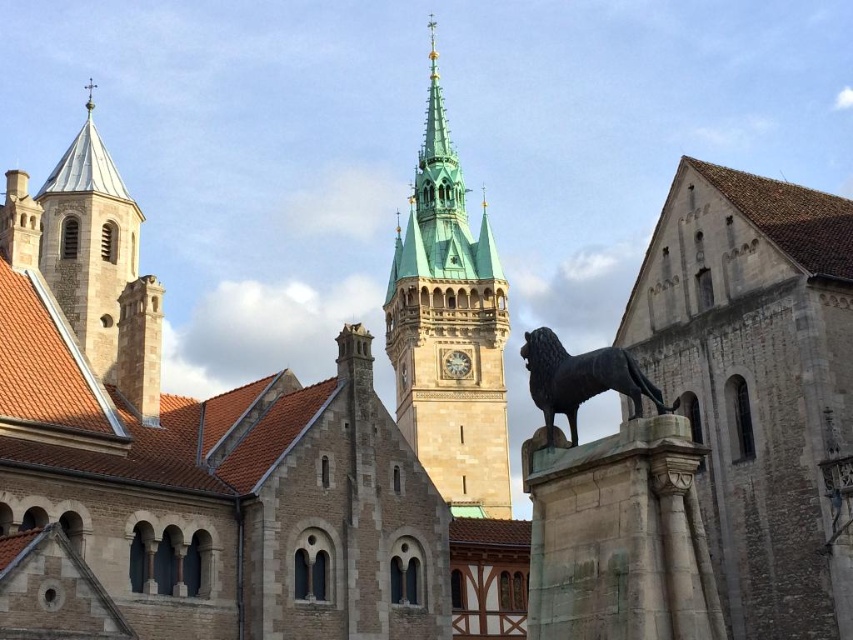
You are an architect designing a new pathway between the bronze statue at center and the metallic clock at center. To ensure accessibility, the path must be at least 1.2 meters wide. Based on the scene, can you confirm if there is enough space between them?

The bronze statue at center might be wider than metallic clock at center, so the space between them may not be sufficient for a 1.2 meter wide path. Further measurements would be needed to confirm.

You are a tourist standing in front of the historic architectural ensemble. You notice the smooth stone tower at upper left and the bronze statue at center. Which object is located higher in the image?

The smooth stone tower at upper left is positioned over the bronze statue at center, so it is higher in the image.

You are an architect examining the historic ensemble and want to determine which object is nearer to you. Based on the scene, which one is closer between the bronze statue at center and the metallic clock at center?

The bronze statue at center is closer to the viewer than the metallic clock at center according to the description.